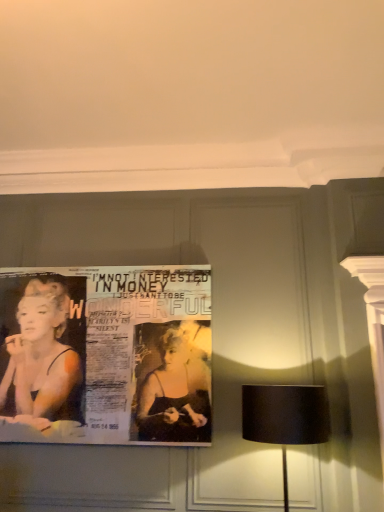
Question: Relative to black fabric lampshade at right, is matte paper poster at left in front or behind?

Choices:
 (A) front
 (B) behind

Answer: (B)

Question: From the image's perspective, is matte paper poster at left above or below black fabric lampshade at right?

Choices:
 (A) below
 (B) above

Answer: (B)

Question: Looking at the image, does matte paper poster at left seem bigger or smaller compared to black fabric lampshade at right?

Choices:
 (A) big
 (B) small

Answer: (B)

Question: Looking at the image, does black fabric lampshade at right seem bigger or smaller compared to matte paper poster at left?

Choices:
 (A) small
 (B) big

Answer: (B)

Question: Is point (317, 410) closer or farther from the camera than point (205, 330)?

Choices:
 (A) farther
 (B) closer

Answer: (B)

Question: Considering the positions of black fabric lampshade at right and matte paper poster at left in the image, is black fabric lampshade at right wider or thinner than matte paper poster at left?

Choices:
 (A) thin
 (B) wide

Answer: (B)

Question: Considering their positions, is black fabric lampshade at right located in front of or behind matte paper poster at left?

Choices:
 (A) front
 (B) behind

Answer: (A)